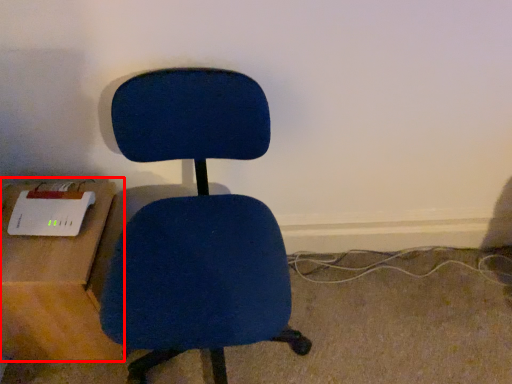
Question: From the image's perspective, considering the relative positions of table (annotated by the red box) and chair in the image provided, where is table (annotated by the red box) located with respect to the staircase?

Choices:
 (A) below
 (B) above

Answer: (A)